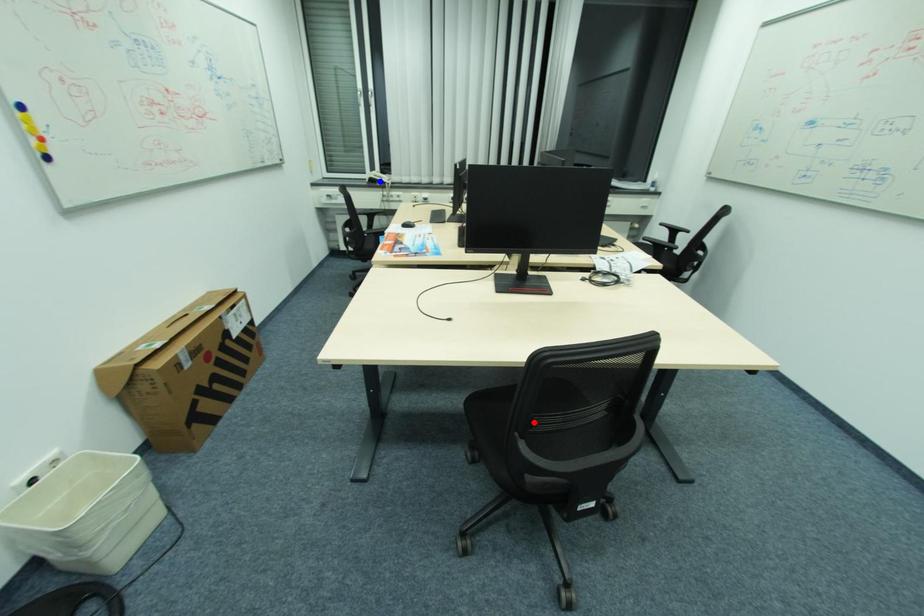
Question: In the image, two points are highlighted. Which point is nearer to the camera? Reply with the corresponding letter.

Choices:
 (A) blue point
 (B) red point

Answer: (B)